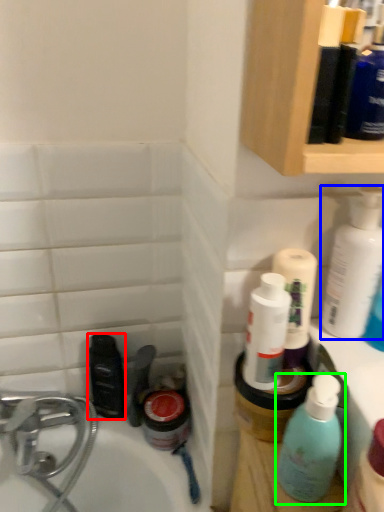
Question: Based on their relative distances, which object is farther from mouthwash (highlighted by a red box)? Choose from cleaning product (highlighted by a blue box) and bottle (highlighted by a green box).

Choices:
 (A) cleaning product
 (B) bottle

Answer: (A)